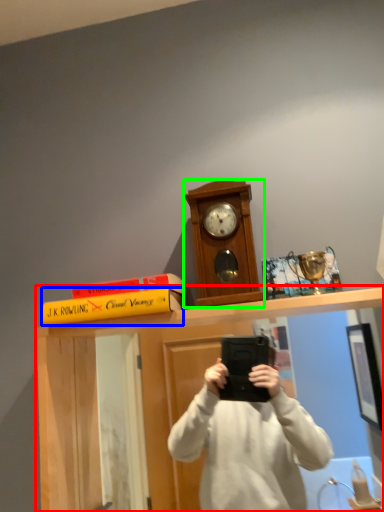
Question: Which is farther away from vanity (highlighted by a red box)? book (highlighted by a blue box) or clock (highlighted by a green box)?

Choices:
 (A) book
 (B) clock

Answer: (B)